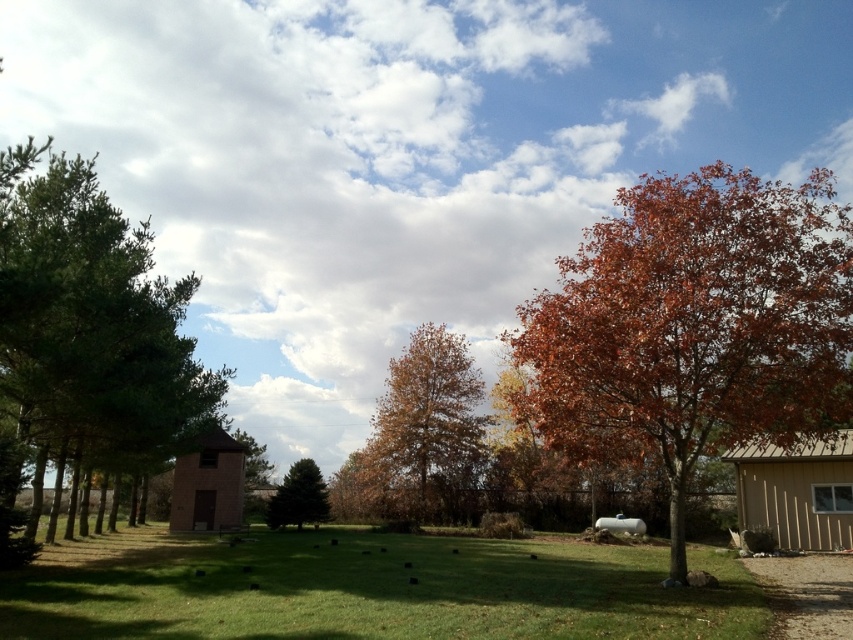
Looking at this image, you are standing in the middle of the grassy area and want to walk to both the point at coordinates point (16, 442) and point (401, 518). Which point will you reach first?

You will reach point (16, 442) first because it is closer to the camera than point (401, 518).

You are standing at the center of the grassy area in the scene. Which direction should you walk to reach the autumn leaves tree at right?

Since the autumn leaves tree at right is located at point 0.511 on the x axis and 0.815 on the y axis, you should walk towards the right side of the image to reach it.

Consider the image. You are standing in the middle of the lawn and want to walk to the green matte evergreen tree at center. Which direction should you walk to avoid the autumn leaves tree at right?

The autumn leaves tree at right is in front of the green matte evergreen tree at center, so to avoid it, walk towards the left side of the green matte evergreen tree at center while moving forward.